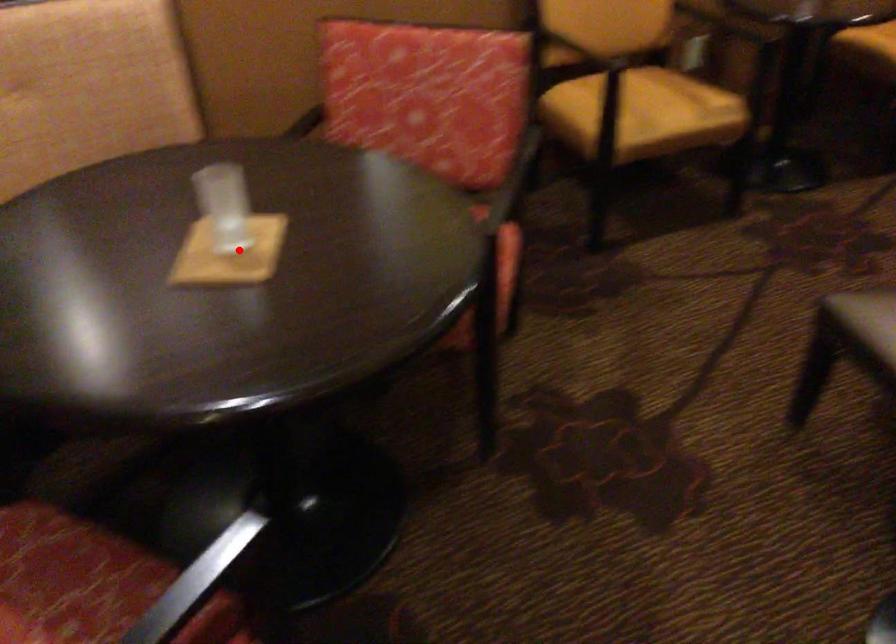
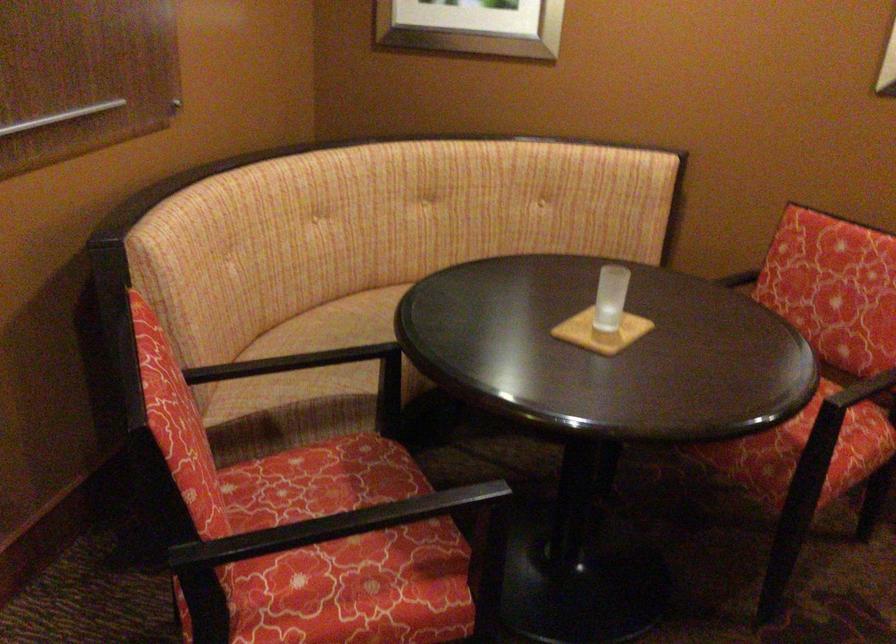
Where in the second image is the point corresponding to the highlighted location from the first image?

(600, 332)